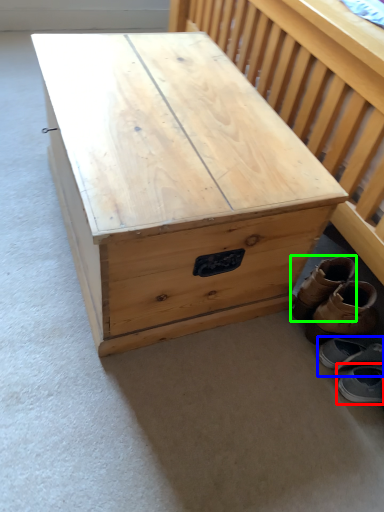
Question: Based on their relative distances, which object is nearer to footwear (highlighted by a red box)? Choose from footwear (highlighted by a blue box) and footwear (highlighted by a green box).

Choices:
 (A) footwear
 (B) footwear

Answer: (A)